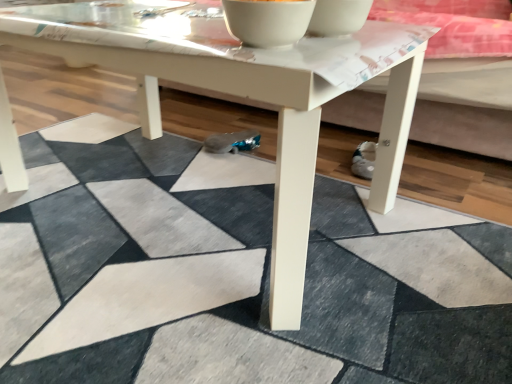
What do you see at coordinates (338, 17) in the screenshot?
I see `white glossy bowl at upper center, which ranks as the 2th bowl in left-to-right order` at bounding box center [338, 17].

Where is `white matte coffee table at center`? This screenshot has width=512, height=384. white matte coffee table at center is located at coordinates (250, 97).

Describe the element at coordinates (250, 97) in the screenshot. The height and width of the screenshot is (384, 512). I see `white matte coffee table at center` at that location.

You are a GUI agent. You are given a task and a screenshot of the screen. Output one action in this format:
    pyautogui.click(x=<x>, y=<y>)
    Task: Click on the white glossy bowl at upper center, the first bowl in the right-to-left sequence
    The image size is (512, 384).
    Given the screenshot: What is the action you would take?
    pyautogui.click(x=338, y=17)

From a real-world perspective, who is located lower, white glossy bowl at upper center, the first bowl from the left, or white matte coffee table at center?

white matte coffee table at center.

Who is bigger, white glossy bowl at upper center, the first bowl from the left, or white matte coffee table at center?

white matte coffee table at center.

Between white glossy bowl at upper center, the first bowl from the left, and white matte coffee table at center, which one has larger width?

white matte coffee table at center.

From the image's perspective, is white glossy bowl at upper center, the first bowl from the left, located beneath white matte coffee table at center?

Actually, white glossy bowl at upper center, the first bowl from the left, appears above white matte coffee table at center in the image.

Is white matte coffee table at center bigger or smaller than white glossy bowl at upper center, acting as the second bowl starting from the right?

white matte coffee table at center is bigger than white glossy bowl at upper center, acting as the second bowl starting from the right.

Is white matte coffee table at center touching white glossy bowl at upper center, the first bowl from the left?

They are not placed beside each other.

Is white matte coffee table at center wider or thinner than white glossy bowl at upper center, the first bowl from the left?

Clearly, white matte coffee table at center has more width compared to white glossy bowl at upper center, the first bowl from the left.

Between white matte coffee table at center and white glossy bowl at upper center, the first bowl from the left, which one has less height?

white glossy bowl at upper center, the first bowl from the left, is shorter.

Based on the photo, from a real-world perspective, does white glossy bowl at upper center, acting as the second bowl starting from the right, sit lower than white glossy bowl at upper center, the first bowl in the right-to-left sequence?

No, from a real-world perspective, white glossy bowl at upper center, acting as the second bowl starting from the right, is not under white glossy bowl at upper center, the first bowl in the right-to-left sequence.

Is white glossy bowl at upper center, acting as the second bowl starting from the right, not close to white glossy bowl at upper center, the first bowl in the right-to-left sequence?

Actually, white glossy bowl at upper center, acting as the second bowl starting from the right, and white glossy bowl at upper center, the first bowl in the right-to-left sequence, are a little close together.

From the picture: Considering the sizes of white glossy bowl at upper center, the first bowl from the left, and white glossy bowl at upper center, which ranks as the 2th bowl in left-to-right order, in the image, is white glossy bowl at upper center, the first bowl from the left, bigger or smaller than white glossy bowl at upper center, which ranks as the 2th bowl in left-to-right order,?

Considering their sizes, white glossy bowl at upper center, the first bowl from the left, takes up more space than white glossy bowl at upper center, which ranks as the 2th bowl in left-to-right order.

Is white glossy bowl at upper center, which ranks as the 2th bowl in left-to-right order, surrounded by white glossy bowl at upper center, acting as the second bowl starting from the right?

Definitely not — white glossy bowl at upper center, which ranks as the 2th bowl in left-to-right order, is not inside white glossy bowl at upper center, acting as the second bowl starting from the right.

Considering the relative sizes of white matte coffee table at center and white glossy bowl at upper center, which ranks as the 2th bowl in left-to-right order, in the image provided, is white matte coffee table at center thinner than white glossy bowl at upper center, which ranks as the 2th bowl in left-to-right order,?

Incorrect, the width of white matte coffee table at center is not less than that of white glossy bowl at upper center, which ranks as the 2th bowl in left-to-right order.

Which is behind, point (317, 49) or point (316, 35)?

Positioned behind is point (316, 35).

Could you measure the distance between white matte coffee table at center and white glossy bowl at upper center, which ranks as the 2th bowl in left-to-right order?

The distance of white matte coffee table at center from white glossy bowl at upper center, which ranks as the 2th bowl in left-to-right order, is 22.58 centimeters.

Is white matte coffee table at center in contact with white glossy bowl at upper center, the first bowl in the right-to-left sequence?

white matte coffee table at center and white glossy bowl at upper center, the first bowl in the right-to-left sequence, are clearly separated.

Is point (317, 6) less distant than point (172, 46)?

No, it is not.

From a real-world perspective, is white glossy bowl at upper center, which ranks as the 2th bowl in left-to-right order, beneath white matte coffee table at center?

Incorrect, from a real-world perspective, white glossy bowl at upper center, which ranks as the 2th bowl in left-to-right order, is higher than white matte coffee table at center.

Would you say white glossy bowl at upper center, which ranks as the 2th bowl in left-to-right order, is to the left or to the right of white matte coffee table at center in the picture?

From the image, it's evident that white glossy bowl at upper center, which ranks as the 2th bowl in left-to-right order, is to the right of white matte coffee table at center.

Based on the photo, is white glossy bowl at upper center, the first bowl in the right-to-left sequence, closer to camera compared to white matte coffee table at center?

No.

Does white glossy bowl at upper center, the first bowl in the right-to-left sequence, have a smaller size compared to white glossy bowl at upper center, the first bowl from the left?

Yes.

Is white glossy bowl at upper center, the first bowl in the right-to-left sequence, not near white glossy bowl at upper center, acting as the second bowl starting from the right?

That's not correct — white glossy bowl at upper center, the first bowl in the right-to-left sequence, is a little close to white glossy bowl at upper center, acting as the second bowl starting from the right.

What are the coordinates of `bowl directly beneath the white glossy bowl at upper center, the first bowl from the left (from a real-world perspective)` in the screenshot? It's located at (338, 17).

Consider the image. Which object is further away from the camera taking this photo, white glossy bowl at upper center, which ranks as the 2th bowl in left-to-right order, or white glossy bowl at upper center, the first bowl from the left?

white glossy bowl at upper center, which ranks as the 2th bowl in left-to-right order, is further from the camera.

The image size is (512, 384). I want to click on coffee table that appears below the white glossy bowl at upper center, the first bowl from the left (from the image's perspective), so click(250, 97).

Where is `coffee table located underneath the white glossy bowl at upper center, acting as the second bowl starting from the right (from a real-world perspective)`? This screenshot has width=512, height=384. coffee table located underneath the white glossy bowl at upper center, acting as the second bowl starting from the right (from a real-world perspective) is located at coordinates (250, 97).

Estimate the real-world distances between objects in this image. Which object is closer to white glossy bowl at upper center, the first bowl in the right-to-left sequence, white matte coffee table at center or white glossy bowl at upper center, the first bowl from the left?

Among the two, white glossy bowl at upper center, the first bowl from the left, is located nearer to white glossy bowl at upper center, the first bowl in the right-to-left sequence.

Considering their positions, is white glossy bowl at upper center, the first bowl in the right-to-left sequence, positioned closer to white matte coffee table at center than white glossy bowl at upper center, the first bowl from the left?

white glossy bowl at upper center, the first bowl from the left.

Estimate the real-world distances between objects in this image. Which object is closer to white glossy bowl at upper center, acting as the second bowl starting from the right, white matte coffee table at center or white glossy bowl at upper center, the first bowl in the right-to-left sequence?

white glossy bowl at upper center, the first bowl in the right-to-left sequence, is positioned closer to the anchor white glossy bowl at upper center, acting as the second bowl starting from the right.

Based on their spatial positions, is white glossy bowl at upper center, the first bowl from the left, or white matte coffee table at center further from white glossy bowl at upper center, the first bowl in the right-to-left sequence?

white matte coffee table at center is positioned further to the anchor white glossy bowl at upper center, the first bowl in the right-to-left sequence.

Based on their spatial positions, is white glossy bowl at upper center, the first bowl in the right-to-left sequence, or white matte coffee table at center closer to white glossy bowl at upper center, acting as the second bowl starting from the right?

white glossy bowl at upper center, the first bowl in the right-to-left sequence, is closer to white glossy bowl at upper center, acting as the second bowl starting from the right.

When comparing their distances from white matte coffee table at center, does white glossy bowl at upper center, acting as the second bowl starting from the right, or white glossy bowl at upper center, the first bowl in the right-to-left sequence, seem further?

white glossy bowl at upper center, the first bowl in the right-to-left sequence, lies further to white matte coffee table at center than the other object.

Find the location of a particular element. This screenshot has height=384, width=512. bowl between white matte coffee table at center and white glossy bowl at upper center, which ranks as the 2th bowl in left-to-right order is located at coordinates (267, 21).